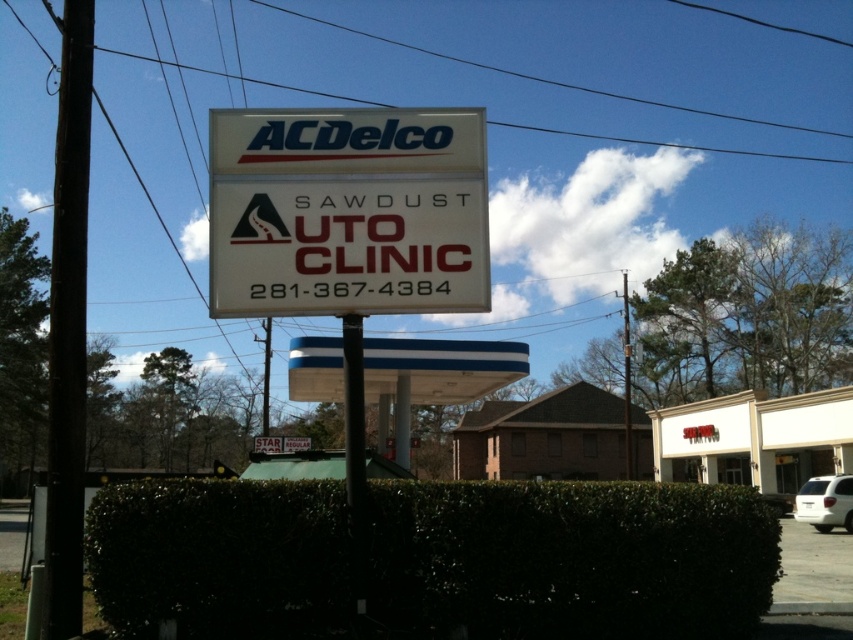
Question: From the image, what is the correct spatial relationship of white plastic sign at center in relation to brown brick motel at center?

Choices:
 (A) left
 (B) right

Answer: (A)

Question: Estimate the real-world distances between objects in this image. Which object is farther from the brown brick motel at center?

Choices:
 (A) green leafy hedge at center
 (B) white plastic sign at center

Answer: (B)

Question: Which object is positioned farthest from the brown brick motel at center?

Choices:
 (A) green leafy hedge at center
 (B) white plastic sign at center

Answer: (B)

Question: Which of the following is the closest to the observer?

Choices:
 (A) white plastic sign at center
 (B) green leafy hedge at center

Answer: (B)

Question: Does green leafy hedge at center appear over white plastic sign at center?

Choices:
 (A) yes
 (B) no

Answer: (B)

Question: Observing the image, what is the correct spatial positioning of green leafy hedge at center in reference to white plastic sign at center?

Choices:
 (A) below
 (B) above

Answer: (A)